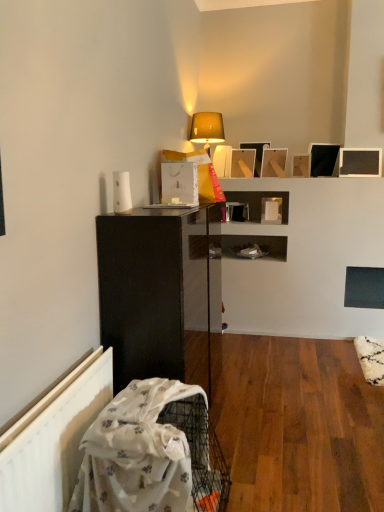
Question: Does matte wooden picture frame at upper center, marked as the 1th picture frame in a left-to-right arrangement, have a larger size compared to matte black cabinet at left?

Choices:
 (A) yes
 (B) no

Answer: (B)

Question: Is matte wooden picture frame at upper center, marked as the 1th picture frame in a left-to-right arrangement, shorter than matte black cabinet at left?

Choices:
 (A) no
 (B) yes

Answer: (B)

Question: Is matte black cabinet at left a part of matte wooden picture frame at upper center, marked as the 1th picture frame in a left-to-right arrangement?

Choices:
 (A) no
 (B) yes

Answer: (A)

Question: Does matte wooden picture frame at upper center, placed as the sixth picture frame when sorted from right to left, come in front of matte black cabinet at left?

Choices:
 (A) no
 (B) yes

Answer: (A)

Question: Considering the relative sizes of matte wooden picture frame at upper center, marked as the 1th picture frame in a left-to-right arrangement, and matte black cabinet at left in the image provided, is matte wooden picture frame at upper center, marked as the 1th picture frame in a left-to-right arrangement, wider than matte black cabinet at left?

Choices:
 (A) yes
 (B) no

Answer: (B)

Question: In terms of height, does matte beige lampshade at upper center look taller or shorter compared to black matte picture frame at upper right, the fifth picture frame viewed from the left?

Choices:
 (A) short
 (B) tall

Answer: (B)

Question: Is matte beige lampshade at upper center inside or outside of black matte picture frame at upper right, which is the second picture frame in right-to-left order?

Choices:
 (A) outside
 (B) inside

Answer: (A)

Question: Considering the positions of matte beige lampshade at upper center and black matte picture frame at upper right, the fifth picture frame viewed from the left, in the image, is matte beige lampshade at upper center bigger or smaller than black matte picture frame at upper right, the fifth picture frame viewed from the left,?

Choices:
 (A) small
 (B) big

Answer: (B)

Question: From the image's perspective, relative to black matte picture frame at upper right, which is the second picture frame in right-to-left order, is matte beige lampshade at upper center above or below?

Choices:
 (A) below
 (B) above

Answer: (B)

Question: Is black matte picture frame at upper right, the fifth picture frame viewed from the left, situated inside matte black picture frame at upper center, marked as the 3th picture frame in a right-to-left arrangement, or outside?

Choices:
 (A) outside
 (B) inside

Answer: (A)

Question: From the image's perspective, is black matte picture frame at upper right, the fifth picture frame viewed from the left, above or below matte black picture frame at upper center, positioned as the fourth picture frame in left-to-right order?

Choices:
 (A) above
 (B) below

Answer: (A)

Question: In terms of height, does black matte picture frame at upper right, the fifth picture frame viewed from the left, look taller or shorter compared to matte black picture frame at upper center, positioned as the fourth picture frame in left-to-right order?

Choices:
 (A) tall
 (B) short

Answer: (A)

Question: Based on their positions, is black matte picture frame at upper right, which is the second picture frame in right-to-left order, located to the left or right of matte black picture frame at upper center, marked as the 3th picture frame in a right-to-left arrangement?

Choices:
 (A) left
 (B) right

Answer: (B)

Question: Is matte black cabinet at left inside the boundaries of white plastic radiator at lower left, or outside?

Choices:
 (A) inside
 (B) outside

Answer: (B)

Question: In terms of size, does matte black cabinet at left appear bigger or smaller than white plastic radiator at lower left?

Choices:
 (A) big
 (B) small

Answer: (A)